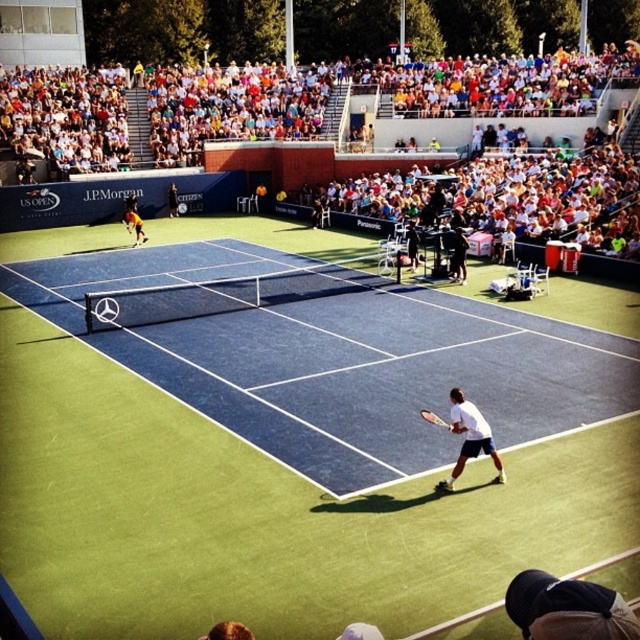
In the scene shown: You are a tennis ball that just bounced on the blue carpet tennis court at center. You want to roll towards the white matte tennis racket at lower center. Which direction should you roll?

Since the blue carpet tennis court at center is to the left of the white matte tennis racket at lower center, you should roll to the right to reach it.

You are a tennis coach observing the match. You notice two white matte tennis rackets in the image. Which racket is positioned lower on the court, the white matte tennis racket at right or the white matte tennis racket at lower center?

The white matte tennis racket at right is located below the white matte tennis racket at lower center, so the racket at the right is positioned lower on the court.